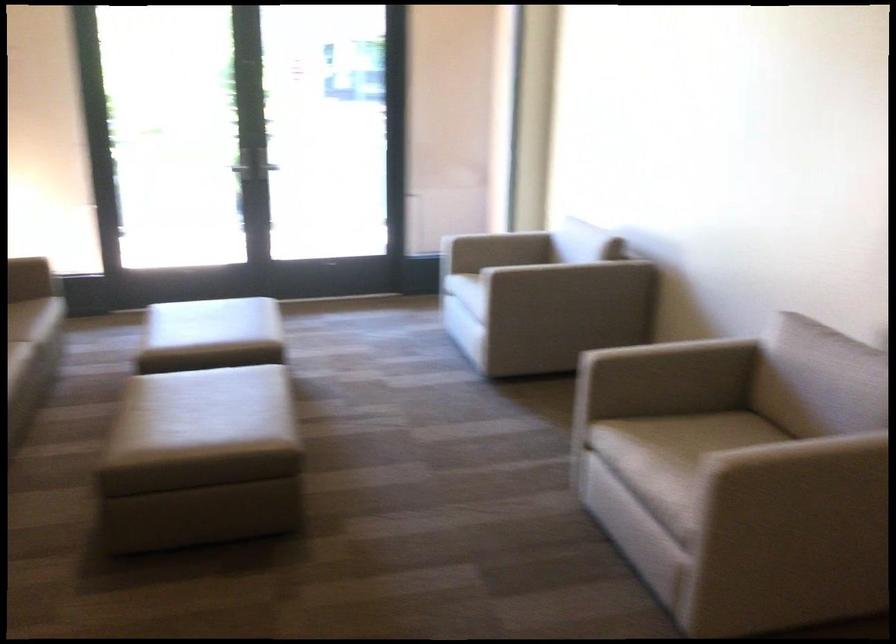
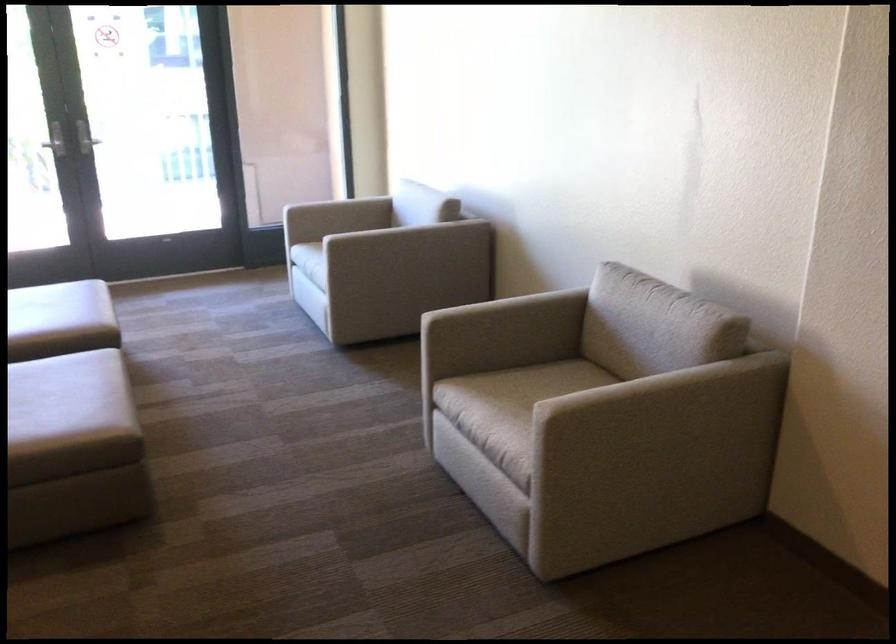
Question: I am providing you with two images of the same scene from different viewpoints. Please identify which objects are invisible in image2.

Choices:
 (A) chair sitting surface
 (B) metal door handle
 (C) chair armrest
 (D) none of these

Answer: (D)